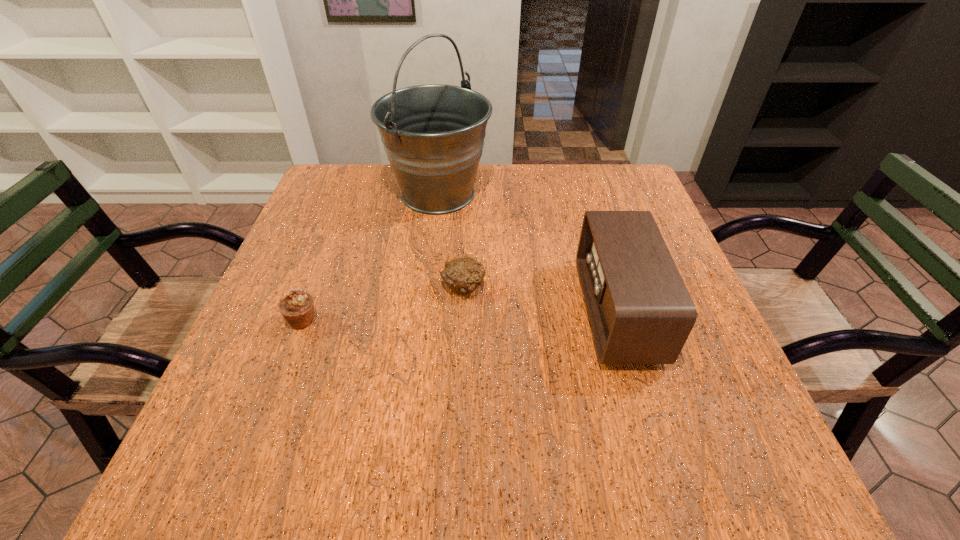
Identify the location of vacant space in between the tallest object and the left muffin. This screenshot has height=540, width=960. (371, 257).

At what (x,y) coordinates should I click in order to perform the action: click on blank region between the second shortest object and the rightmost object. Please return your answer as a coordinate pair (x, y). Looking at the image, I should click on (460, 316).

Image resolution: width=960 pixels, height=540 pixels. I want to click on empty location between the bucket and the third shortest object, so click(528, 253).

Identify which object is located as the nearest to the third shortest object. Please provide its 2D coordinates. Your answer should be formatted as a tuple, i.e. [(x, y)], where the tuple contains the x and y coordinates of a point satisfying the conditions above.

[(463, 275)]

Identify which object is the nearest to the third tallest object. Please provide its 2D coordinates. Your answer should be formatted as a tuple, i.e. [(x, y)], where the tuple contains the x and y coordinates of a point satisfying the conditions above.

[(463, 275)]

Identify the location of vacant area that satisfies the following two spatial constraints: 1. on the back side of the nearer muffin; 2. on the right side of the bucket. This screenshot has width=960, height=540. (351, 194).